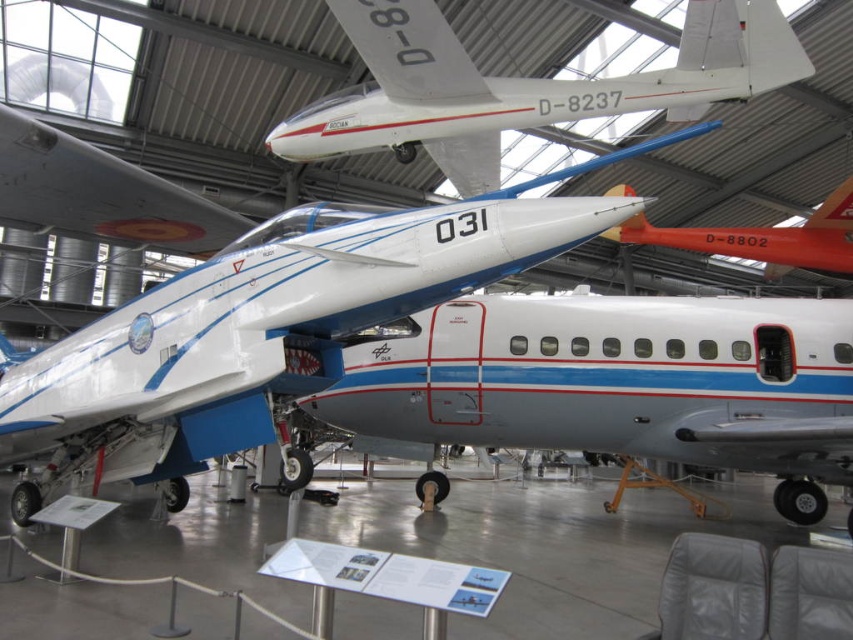
You are standing in the aircraft museum and want to take a photo of the white airplane with blue and red accents marked 031. The museum requires visitors to maintain a minimum distance of 6 meters from all exhibits for safety. If you are currently at point [76,364], can you safely take the photo without violating the distance rule?

The distance between point [76,364] and the viewer is 6.17 meters. Since 6.17 meters is greater than the required 6 meters, you can safely take the photo without violating the museum rules.

You are a tour guide at the aircraft museum and want to direct visitors to the white glossy airplane at upper center. Based on its coordinates, where should visitors look to find it?

The white glossy airplane at upper center is located at coordinates point (520, 86), so visitors should look towards the upper center area of the museum display.